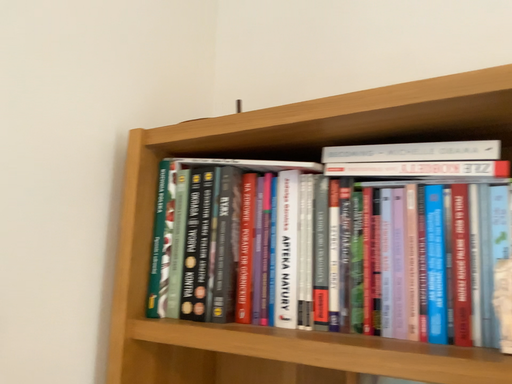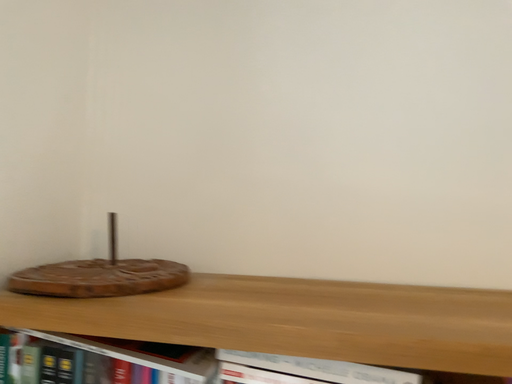
Question: How did the camera likely rotate when shooting the video?

Choices:
 (A) rotated upward
 (B) rotated downward

Answer: (B)